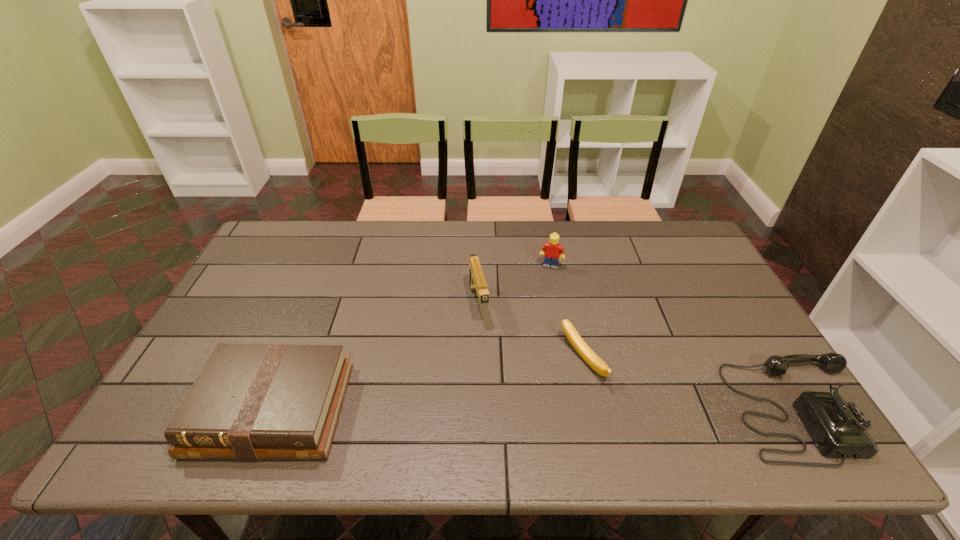
You are a GUI agent. You are given a task and a screenshot of the screen. Output one action in this format:
    pyautogui.click(x=<x>, y=<y>)
    Task: Click on the leftmost object
    The image size is (960, 540).
    Given the screenshot: What is the action you would take?
    pyautogui.click(x=251, y=401)

The width and height of the screenshot is (960, 540). What are the coordinates of `the second shortest object` in the screenshot? It's located at (251, 401).

The width and height of the screenshot is (960, 540). I want to click on the rightmost object, so click(838, 428).

This screenshot has height=540, width=960. What are the coordinates of `the shortest object` in the screenshot? It's located at (589, 356).

Locate an element on the screen. pistol is located at coordinates (477, 282).

Image resolution: width=960 pixels, height=540 pixels. Find the location of `the second farthest object`. the second farthest object is located at coordinates (477, 282).

You are a GUI agent. You are given a task and a screenshot of the screen. Output one action in this format:
    pyautogui.click(x=<x>, y=<y>)
    Task: Click on the farthest object
    
    Given the screenshot: What is the action you would take?
    pyautogui.click(x=552, y=250)

Image resolution: width=960 pixels, height=540 pixels. Find the location of `vacant space located 0.170m at the stem of the banana`. vacant space located 0.170m at the stem of the banana is located at coordinates (514, 406).

Identify the location of vacant area located 0.160m at the stem of the banana. This screenshot has width=960, height=540. (517, 403).

You are a GUI agent. You are given a task and a screenshot of the screen. Output one action in this format:
    pyautogui.click(x=<x>, y=<y>)
    Task: Click on the free space located 0.060m at the stem of the banana
    
    Given the screenshot: What is the action you would take?
    pyautogui.click(x=550, y=386)